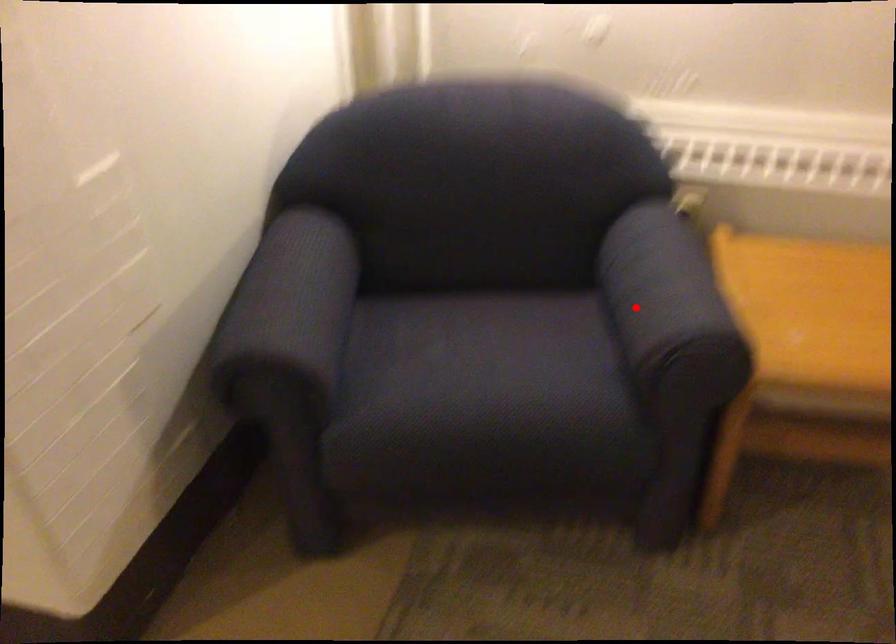
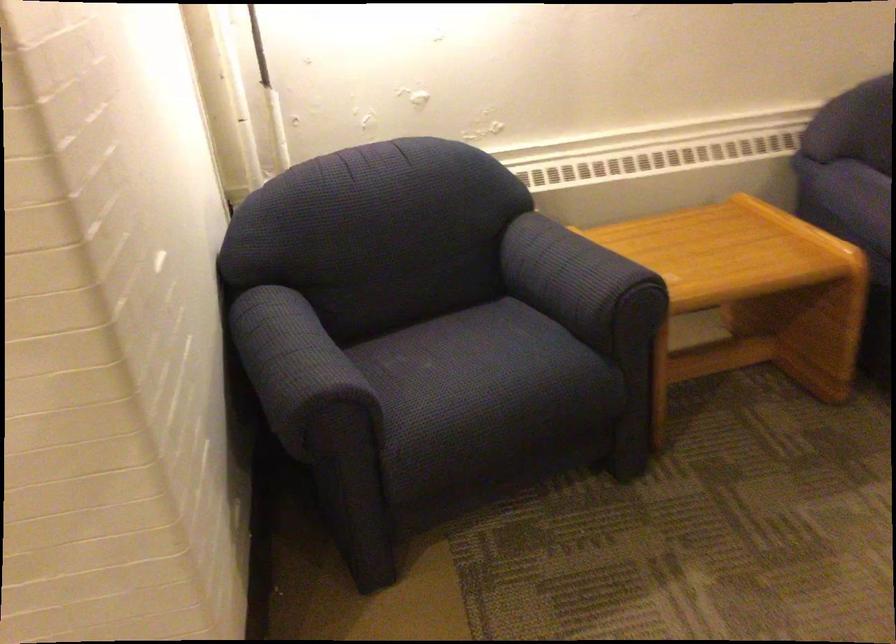
Locate, in the second image, the point that corresponds to the highlighted location in the first image.

(579, 281)